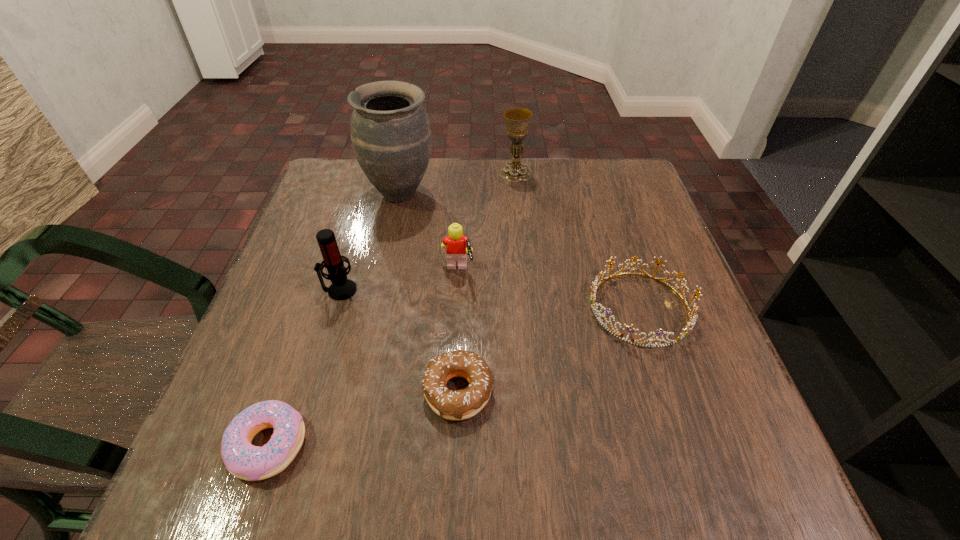
In order to click on urn present at the left edge in this screenshot , I will do `click(390, 131)`.

You are a GUI agent. You are given a task and a screenshot of the screen. Output one action in this format:
    pyautogui.click(x=<x>, y=<y>)
    Task: Click on the microphone that is at the left edge
    
    Given the screenshot: What is the action you would take?
    click(x=342, y=288)

Identify the location of doughnut that is at the left edge. (242, 459).

Find the location of a particular element. The image size is (960, 540). object positioned at the right edge is located at coordinates (594, 287).

At what (x,y) coordinates should I click in order to perform the action: click on object located at the far left corner. Please return your answer as a coordinate pair (x, y). The width and height of the screenshot is (960, 540). Looking at the image, I should click on (390, 131).

Locate an element on the screen. The height and width of the screenshot is (540, 960). object located at the near left corner is located at coordinates (242, 459).

In order to click on free space at the far edge of the desktop in this screenshot , I will do `click(423, 185)`.

At what (x,y) coordinates should I click in order to perform the action: click on vacant point at the near edge. Please return your answer as a coordinate pair (x, y). Looking at the image, I should click on (434, 460).

Identify the location of free region at the left edge. (310, 267).

At what (x,y) coordinates should I click in order to perform the action: click on vacant region at the right edge of the desktop. Please return your answer as a coordinate pair (x, y). The width and height of the screenshot is (960, 540). Looking at the image, I should click on (654, 303).